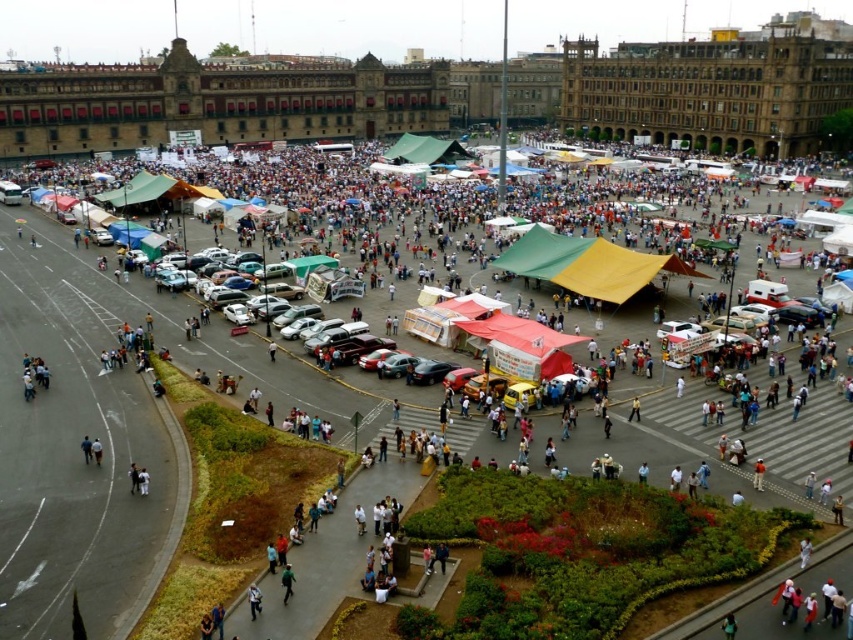
Question: Which point is closer to the camera?

Choices:
 (A) green canvas tent at center
 (B) green fabric canopy at lower left

Answer: (B)

Question: Does green canvas tent at center have a greater width compared to green fabric canopy at lower left?

Choices:
 (A) yes
 (B) no

Answer: (A)

Question: Does green/yellow fabric tent at center have a lesser width compared to green canvas tent at center?

Choices:
 (A) no
 (B) yes

Answer: (A)

Question: Estimate the real-world distances between objects in this image. Which object is closer to the green fabric canopy at lower left?

Choices:
 (A) green/yellow fabric tent at center
 (B) green canvas tent at center

Answer: (B)

Question: Is green/yellow fabric tent at center to the left of green fabric canopy at lower left from the viewer's perspective?

Choices:
 (A) no
 (B) yes

Answer: (A)

Question: Which point is farther to the camera?

Choices:
 (A) green fabric canopy at lower left
 (B) green canvas tent at center
 (C) green/yellow fabric tent at center

Answer: (B)